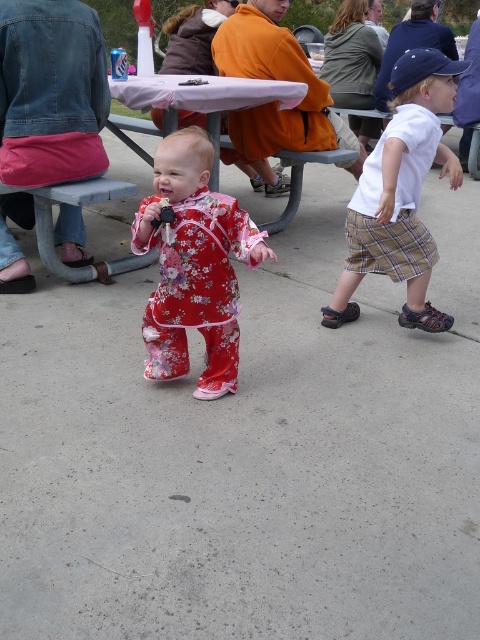
Between point (219, 356) and point (217, 125), which one is positioned in front?

Point (219, 356)

Does floral cotton outfit at center have a greater height compared to white plastic picnic table at center?

In fact, floral cotton outfit at center may be shorter than white plastic picnic table at center.

Locate an element on the screen. This screenshot has width=480, height=640. floral cotton outfit at center is located at coordinates (193, 264).

You are a GUI agent. You are given a task and a screenshot of the screen. Output one action in this format:
    pyautogui.click(x=<x>, y=<y>)
    Task: Click on the floral cotton outfit at center
    This screenshot has width=480, height=640.
    Given the screenshot: What is the action you would take?
    pyautogui.click(x=193, y=264)

Is floral cotton outfit at center further to camera compared to white cotton shirt at right?

No, floral cotton outfit at center is in front of white cotton shirt at right.

Is point (225, 227) behind point (356, 211)?

No, (225, 227) is in front of (356, 211).

The height and width of the screenshot is (640, 480). Find the location of `floral cotton outfit at center`. floral cotton outfit at center is located at coordinates (193, 264).

Does white cotton shirt at right have a lesser height compared to white plastic picnic table at center?

No, white cotton shirt at right is not shorter than white plastic picnic table at center.

Can you confirm if white cotton shirt at right is smaller than white plastic picnic table at center?

Correct, white cotton shirt at right occupies less space than white plastic picnic table at center.

The image size is (480, 640). What are the coordinates of `white cotton shirt at right` in the screenshot? It's located at (400, 193).